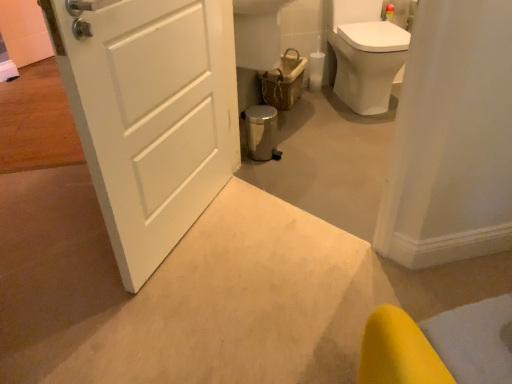
Question: Does woven brown basket at center have a larger size compared to white matte door at center?

Choices:
 (A) no
 (B) yes

Answer: (A)

Question: Is woven brown basket at center surrounding white matte door at center?

Choices:
 (A) yes
 (B) no

Answer: (B)

Question: Is woven brown basket at center facing towards white matte door at center?

Choices:
 (A) no
 (B) yes

Answer: (A)

Question: Is woven brown basket at center to the left of white matte door at center from the viewer's perspective?

Choices:
 (A) no
 (B) yes

Answer: (A)

Question: Does woven brown basket at center come behind white matte door at center?

Choices:
 (A) yes
 (B) no

Answer: (A)

Question: Would you say woven brown basket at center is to the left or to the right of white glossy toilet at upper right in the picture?

Choices:
 (A) right
 (B) left

Answer: (B)

Question: In terms of size, does woven brown basket at center appear bigger or smaller than white glossy toilet at upper right?

Choices:
 (A) small
 (B) big

Answer: (A)

Question: Considering the positions of point (301, 64) and point (384, 51), is point (301, 64) closer or farther from the camera than point (384, 51)?

Choices:
 (A) farther
 (B) closer

Answer: (A)

Question: From a real-world perspective, relative to white glossy toilet at upper right, is woven brown basket at center vertically above or below?

Choices:
 (A) above
 (B) below

Answer: (B)

Question: From their relative heights in the image, would you say white glossy toilet at upper right is taller or shorter than white matte door at center?

Choices:
 (A) short
 (B) tall

Answer: (A)

Question: Considering the positions of point (380, 96) and point (122, 94), is point (380, 96) closer or farther from the camera than point (122, 94)?

Choices:
 (A) closer
 (B) farther

Answer: (B)

Question: Considering the positions of white glossy toilet at upper right and white matte door at center in the image, is white glossy toilet at upper right wider or thinner than white matte door at center?

Choices:
 (A) thin
 (B) wide

Answer: (B)

Question: Looking at the image, does white glossy toilet at upper right seem bigger or smaller compared to white matte door at center?

Choices:
 (A) big
 (B) small

Answer: (A)

Question: In terms of width, does white matte door at center look wider or thinner when compared to woven brown basket at center?

Choices:
 (A) wide
 (B) thin

Answer: (B)

Question: Is white matte door at center spatially inside woven brown basket at center, or outside of it?

Choices:
 (A) outside
 (B) inside

Answer: (A)